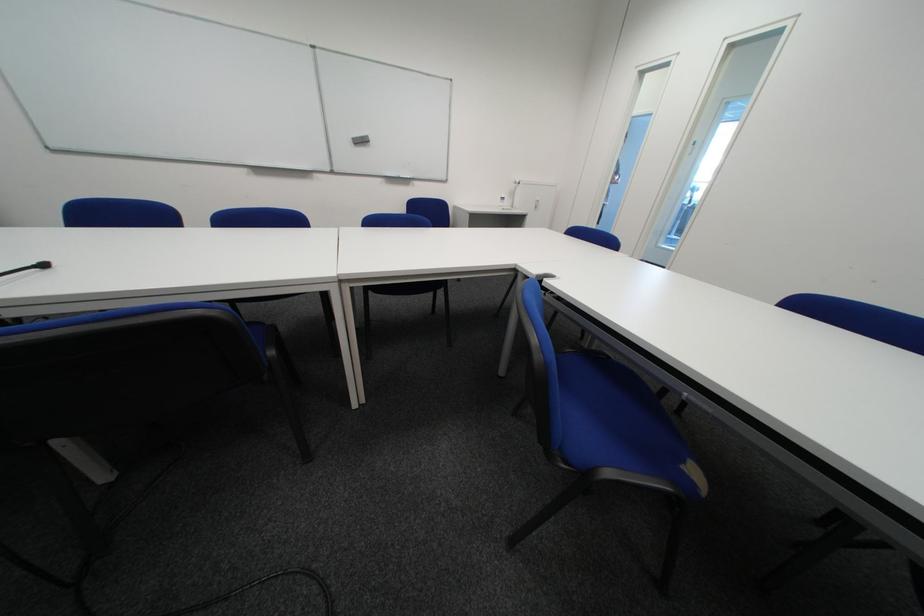
You are a GUI agent. You are given a task and a screenshot of the screen. Output one action in this format:
    pyautogui.click(x=<x>, y=<y>)
    Task: Click on the gray whiteboard eraser
    
    Given the screenshot: What is the action you would take?
    pyautogui.click(x=360, y=140)